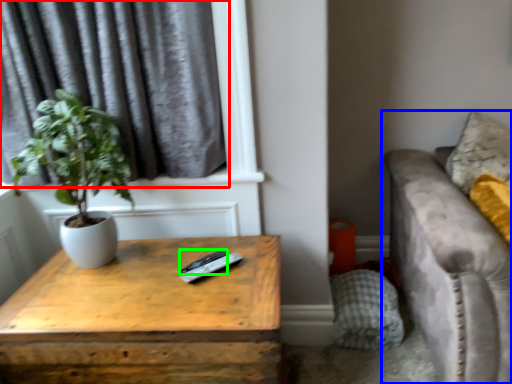
Question: Considering the real-world distances, which object is farthest from curtain (highlighted by a red box)? studio couch (highlighted by a blue box) or remote (highlighted by a green box)?

Choices:
 (A) studio couch
 (B) remote

Answer: (A)